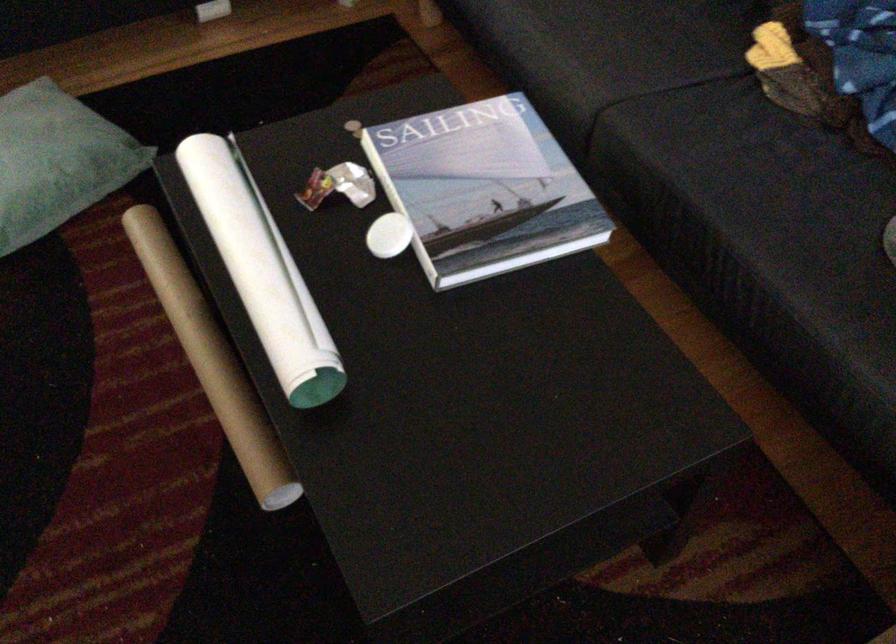
Find where to sit the sofa sitting surface. Please return your answer as a coordinate pair (x, y).

(778, 199)